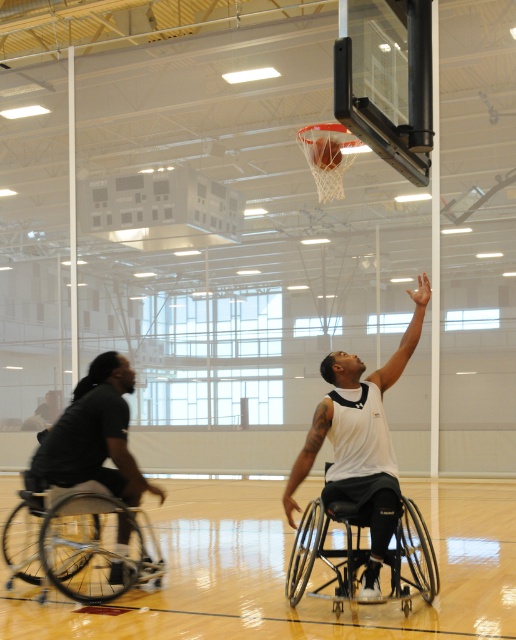
Based on the photo, can you confirm if white matte wheelchair at center is shorter than black matte wheelchair at center?

No, white matte wheelchair at center is not shorter than black matte wheelchair at center.

The width and height of the screenshot is (516, 640). In order to click on white matte wheelchair at center in this screenshot , I will do `click(360, 442)`.

The image size is (516, 640). I want to click on wooden floor at center, so click(284, 572).

Locate an element on the screen. This screenshot has width=516, height=640. wooden floor at center is located at coordinates (284, 572).

Who is lower down, white jersey at center or black matte wheelchair at center?

black matte wheelchair at center

Is point (387, 516) closer to viewer compared to point (431, 556)?

Yes, it is in front of point (431, 556).

From the picture: Measure the distance between point (387, 529) and camera.

The distance of point (387, 529) from camera is 7.08 meters.

This screenshot has height=640, width=516. Identify the location of white jersey at center. (360, 442).